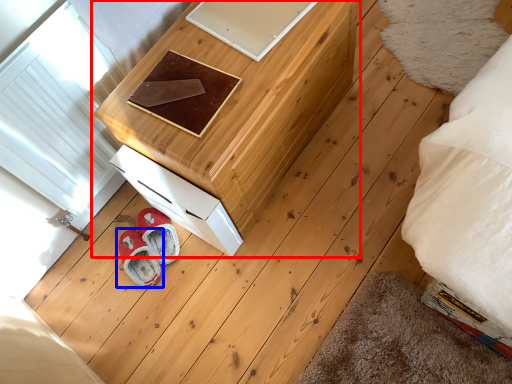
Question: Among these objects, which one is farthest to the camera, furniture (highlighted by a red box) or footwear (highlighted by a blue box)?

Choices:
 (A) furniture
 (B) footwear

Answer: (B)